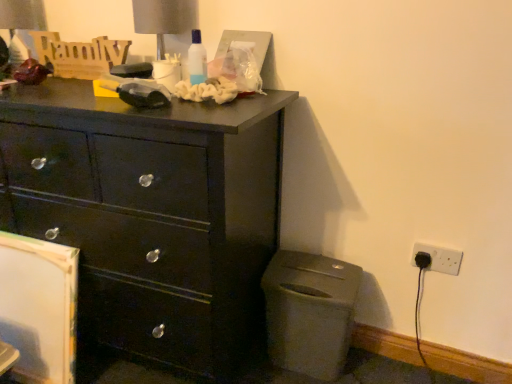
Question: Is white plastic electrical outlet at lower right, which is counted as the first electric outlet, starting from the right, in front of or behind matte plastic trash can at lower right in the image?

Choices:
 (A) front
 (B) behind

Answer: (B)

Question: Is white plastic electrical outlet at lower right, which is counted as the first electric outlet, starting from the right, wider or thinner than matte plastic trash can at lower right?

Choices:
 (A) thin
 (B) wide

Answer: (A)

Question: Which is farther from the black plastic electric outlet at lower right, the second electric outlet when ordered from right to left?

Choices:
 (A) matte plastic trash can at lower right
 (B) matte black chest of drawers at left
 (C) metallic gray table lamp at upper center
 (D) white plastic electrical outlet at lower right, which is counted as the first electric outlet, starting from the right

Answer: (C)

Question: Considering the real-world distances, which object is farthest from the black plastic electric outlet at lower right, which is the 1th electric outlet in left-to-right order?

Choices:
 (A) matte plastic trash can at lower right
 (B) matte black chest of drawers at left
 (C) white plastic electrical outlet at lower right, which is the 2th electric outlet in left-to-right order
 (D) metallic gray table lamp at upper center

Answer: (D)